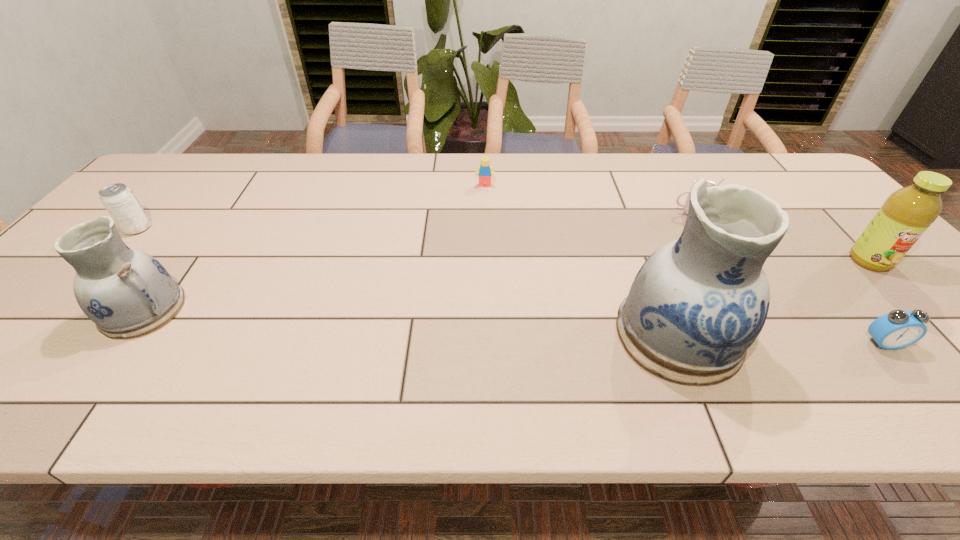
Where is `the sixth object from right to left`? This screenshot has width=960, height=540. the sixth object from right to left is located at coordinates (127, 293).

The height and width of the screenshot is (540, 960). Identify the location of the left pottery. (127, 293).

Find the location of a particular element. the right pottery is located at coordinates (696, 305).

Where is `the tallest object`? This screenshot has height=540, width=960. the tallest object is located at coordinates [696, 305].

What are the coordinates of `Lego` in the screenshot? It's located at (484, 171).

The width and height of the screenshot is (960, 540). In order to click on the farthest object in this screenshot , I will do `click(484, 171)`.

Identify the location of soda can. The width and height of the screenshot is (960, 540). (120, 202).

At what (x,y) coordinates should I click in order to perform the action: click on cup. Please return your answer as a coordinate pair (x, y). Looking at the image, I should click on pos(708,183).

Where is `fruit juice`? This screenshot has height=540, width=960. fruit juice is located at coordinates (906, 214).

The width and height of the screenshot is (960, 540). In order to click on the rightmost object in this screenshot , I will do (906, 214).